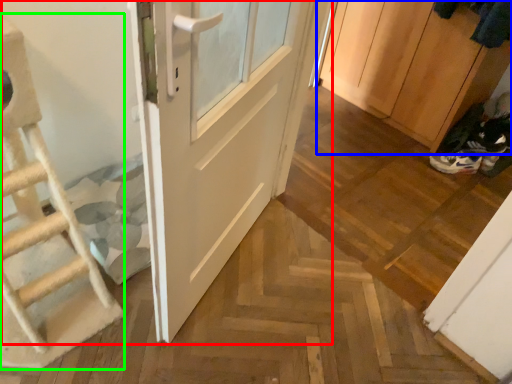
Question: Which object is the closest to the door (highlighted by a red box)? Choose among these: cabinetry (highlighted by a blue box) or ladder (highlighted by a green box).

Choices:
 (A) cabinetry
 (B) ladder

Answer: (B)